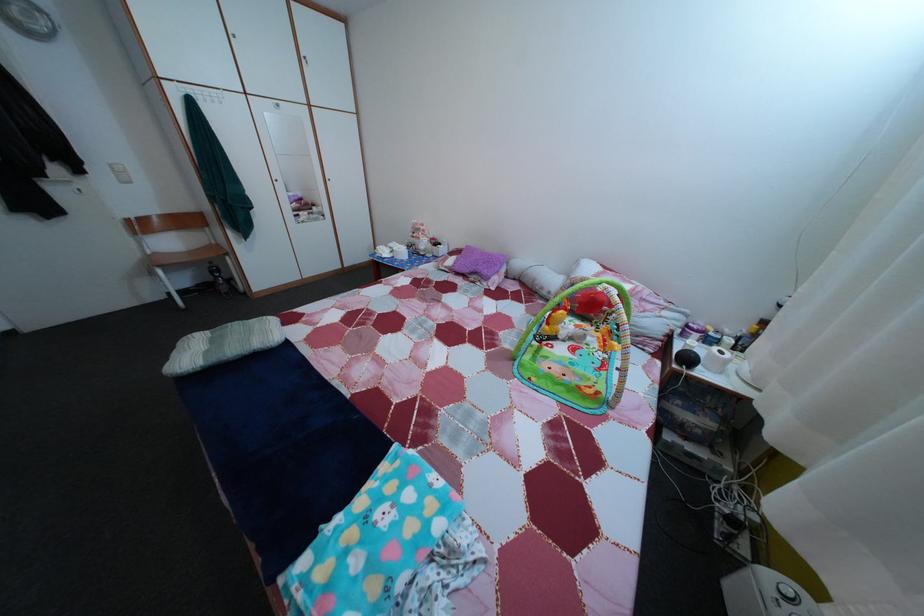
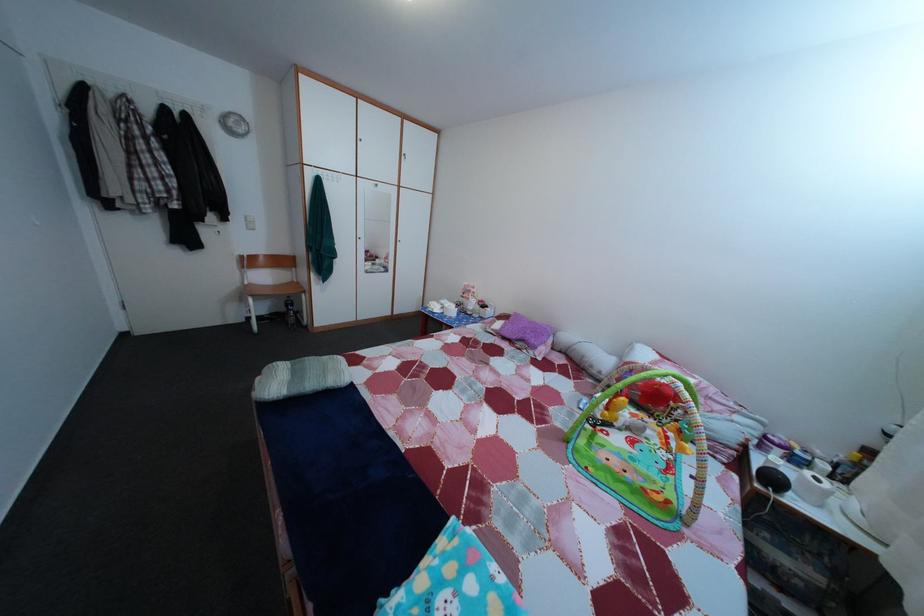
Question: Based on the continuous images, in which direction is the camera rotating? Reply with the corresponding letter.

Choices:
 (A) Left
 (B) Right
 (C) Up
 (D) Down

Answer: (C)